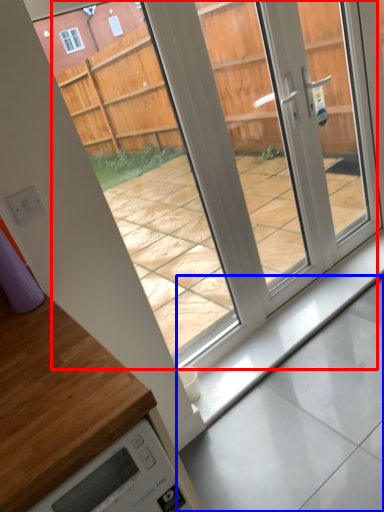
Question: Among these objects, which one is nearest to the camera, glass door (highlighted by a red box) or concrete (highlighted by a blue box)?

Choices:
 (A) glass door
 (B) concrete

Answer: (A)